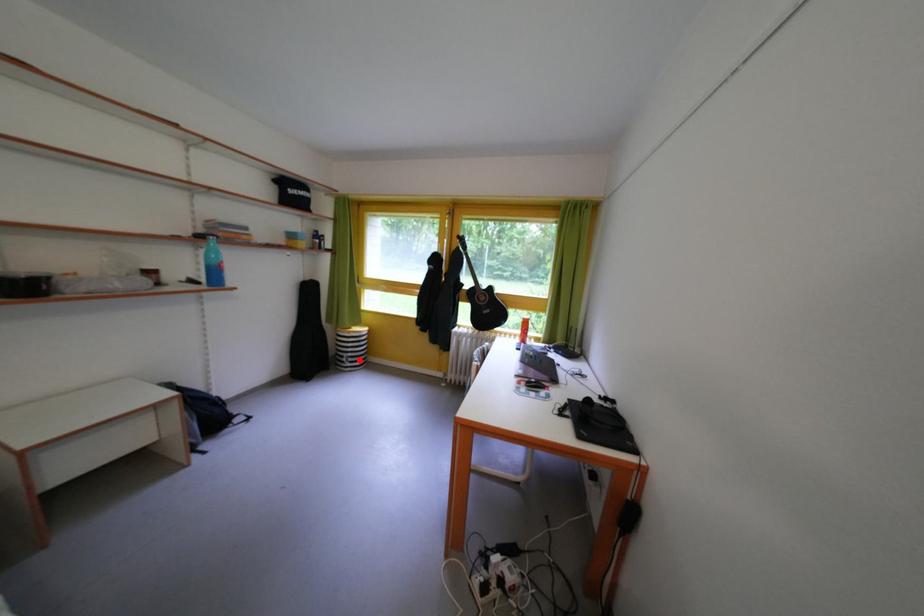
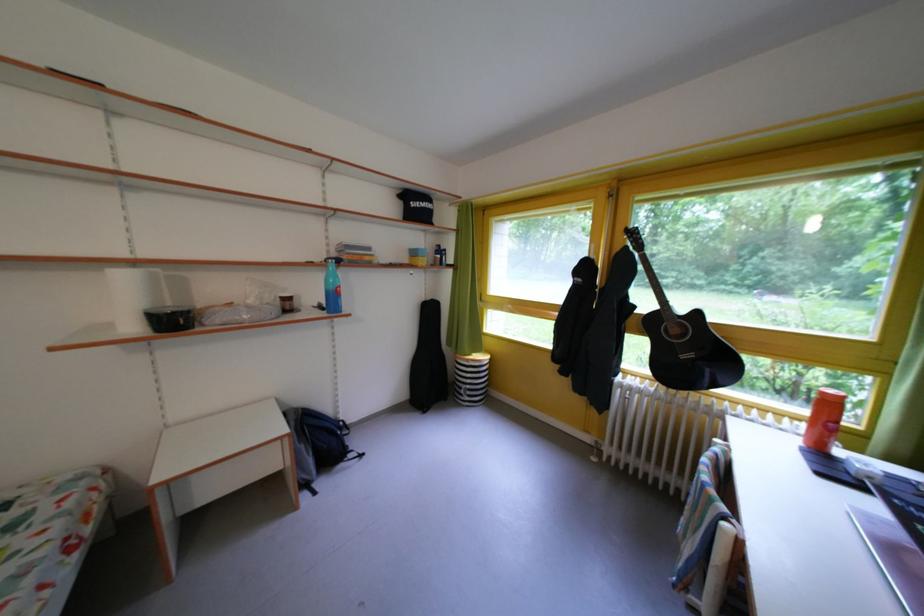
Question: I am providing you with two images of the same scene from different viewpoints. Given a red point in image1, look at the same physical point in image2. Is it:

Choices:
 (A) Closer to the viewpoint
 (B) Farther from the viewpoint

Answer: (B)